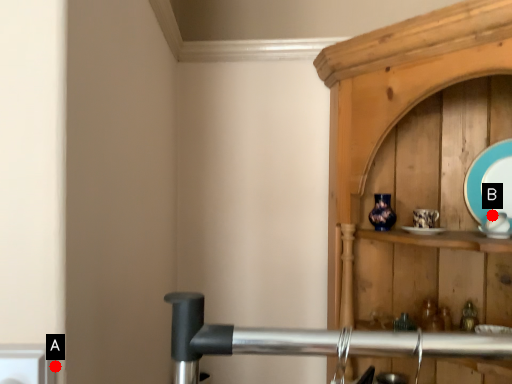
Question: Two points are circled on the image, labeled by A and B beside each circle. Which point is closer to the camera taking this photo?

Choices:
 (A) A is closer
 (B) B is closer

Answer: (A)